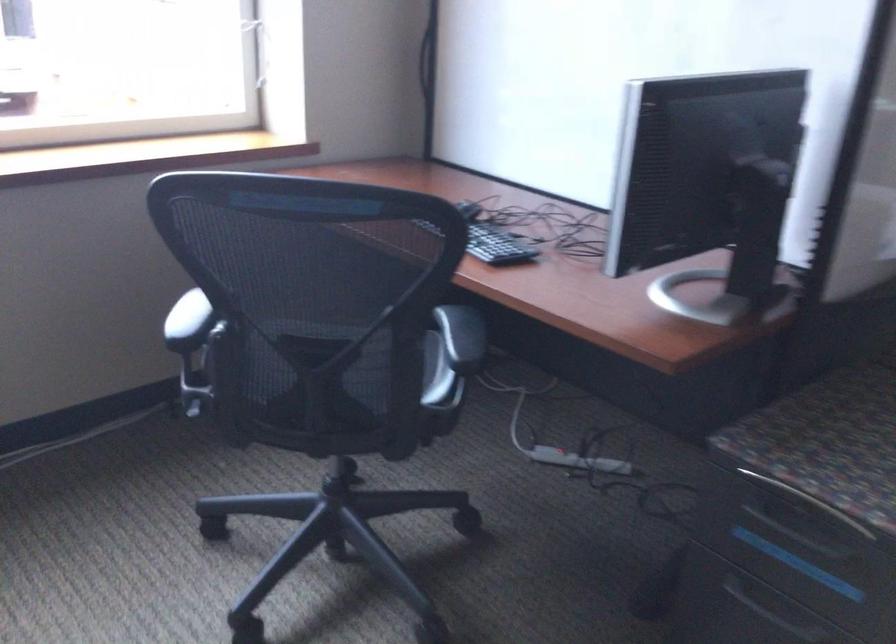
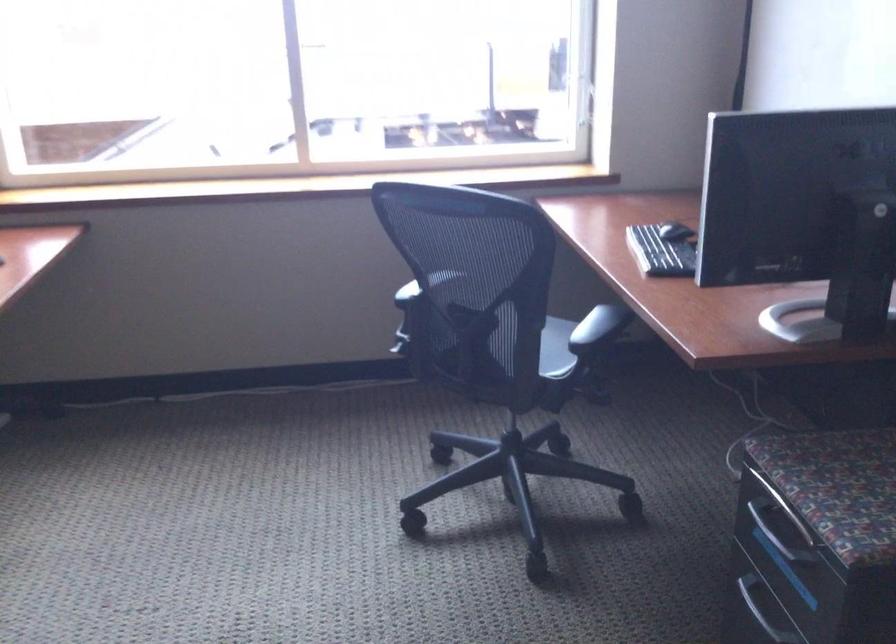
Locate, in the second image, the point that corresponds to pixel 431 373 in the first image.

(541, 345)